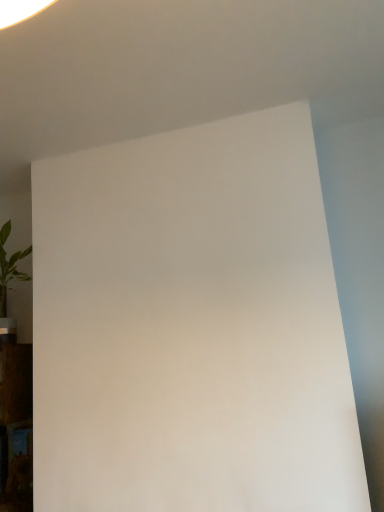
Describe the element at coordinates (10, 267) in the screenshot. I see `green leafy plant at left` at that location.

I want to click on green leafy plant at left, so click(x=10, y=267).

What are the coordinates of `green leafy plant at left` in the screenshot? It's located at (10, 267).